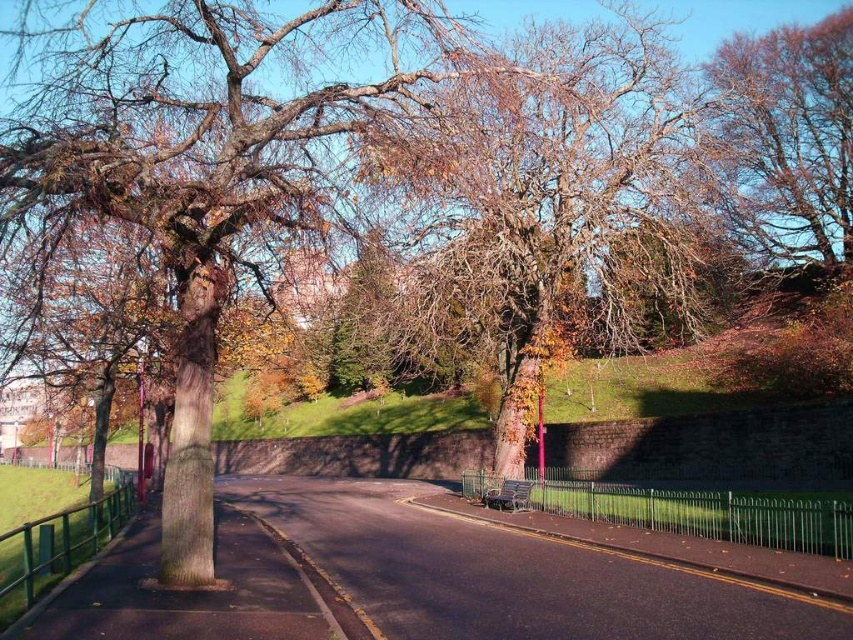
Question: Which object is closer to the camera taking this photo?

Choices:
 (A) brown textured tree at upper right
 (B) brown rough bark tree at left
 (C) brown rough bark tree at center

Answer: (B)

Question: Which of the following is the closest to the observer?

Choices:
 (A) brown rough bark tree at left
 (B) brown rough bark tree at center
 (C) brown textured tree at upper right

Answer: (A)

Question: Can you confirm if brown rough bark tree at left is positioned above brown rough bark tree at center?

Choices:
 (A) yes
 (B) no

Answer: (A)

Question: Is brown rough bark tree at center positioned behind brown textured tree at upper right?

Choices:
 (A) yes
 (B) no

Answer: (B)

Question: Is brown rough bark tree at left positioned before brown textured tree at upper right?

Choices:
 (A) yes
 (B) no

Answer: (A)

Question: Which point is farther to the camera?

Choices:
 (A) (184, 355)
 (B) (741, 61)
 (C) (547, 284)

Answer: (B)